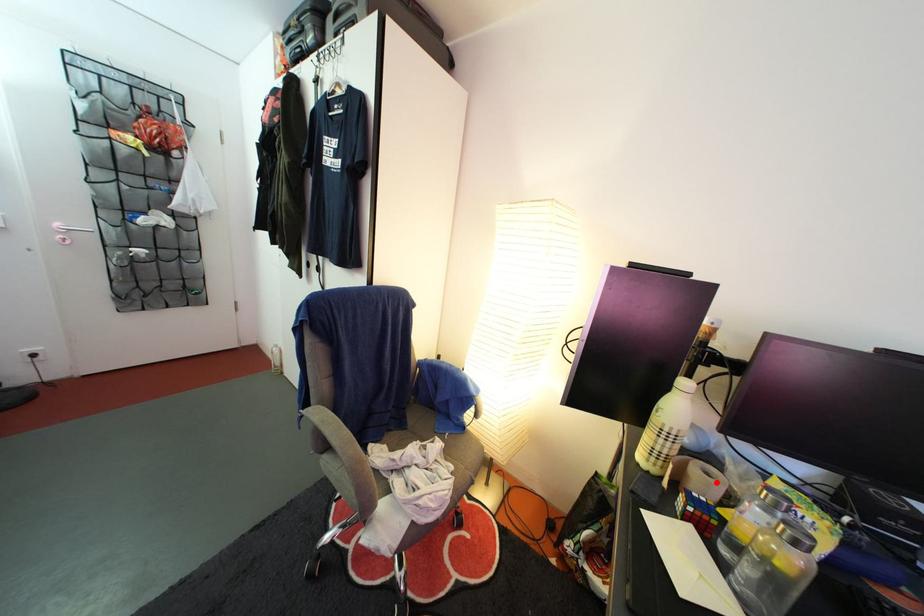
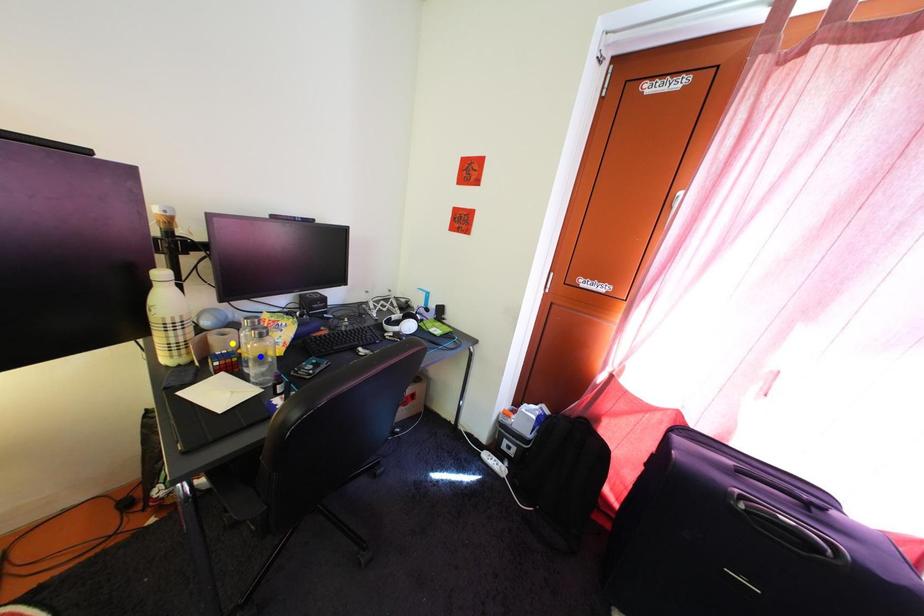
Question: I am providing you with two images of the same scene from different viewpoints. A red point is marked on the first image. You are given multiple points on the second image. Which spot in image 2 lines up with the point in image 1?

Choices:
 (A) yellow point
 (B) green point
 (C) blue point

Answer: (A)